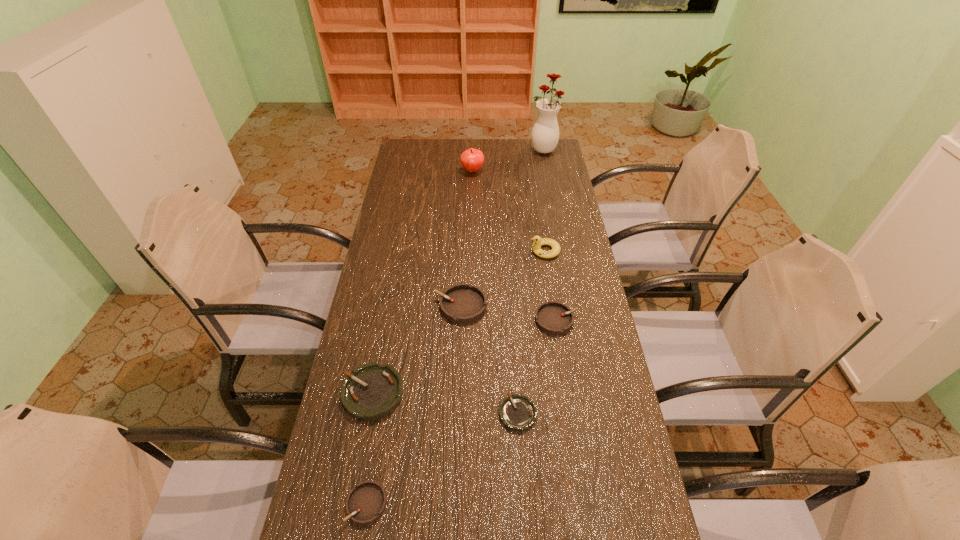
Locate an element on the screen. the farthest object is located at coordinates click(x=545, y=134).

Find the location of `vase`. vase is located at coordinates (545, 134).

This screenshot has width=960, height=540. In order to click on apple in this screenshot , I will do `click(472, 159)`.

Where is `the seventh nearest object`? the seventh nearest object is located at coordinates (472, 159).

At what (x,y) coordinates should I click in order to perform the action: click on the third farthest object. Please return your answer as a coordinate pair (x, y). The image size is (960, 540). Looking at the image, I should click on (538, 241).

You are a GUI agent. You are given a task and a screenshot of the screen. Output one action in this format:
    pyautogui.click(x=<x>, y=<y>)
    Task: Click on the duckling
    This screenshot has height=540, width=960.
    Given the screenshot: What is the action you would take?
    pyautogui.click(x=538, y=241)

Locate an element on the screen. the second gray ashtray from right to left is located at coordinates (462, 303).

This screenshot has width=960, height=540. Identify the location of the fifth shortest object. (462, 303).

Locate an element on the screen. This screenshot has width=960, height=540. the second smallest gray ashtray is located at coordinates (555, 318).

The width and height of the screenshot is (960, 540). In order to click on the rightmost ashtray in this screenshot , I will do `click(555, 318)`.